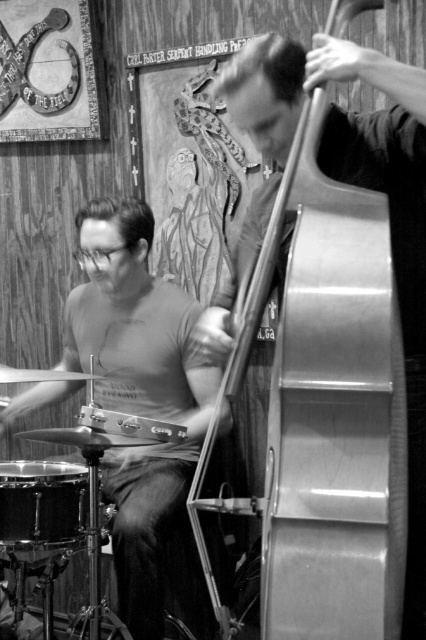
You are a stagehand setting up equipment for a performance. You need to move both the matte black drum set at left and the metallic silver cello at right. Which object requires more space to move around due to its size?

The matte black drum set at left requires more space to move around because it has a larger size compared to the metallic silver cello at right.

You are a stagehand setting up microphones for the drum set and the individual drum. You need to place a microphone stand that is 1.5 meters tall. Which object, the matte black drum set at left or the black drum at lower left, will require the stand to be raised higher to capture the sound properly?

The matte black drum set at left is much taller as black drum at lower left, so the microphone stand needs to be raised higher for the matte black drum set at left to capture the sound properly.

You are standing in the live music venue and want to know which point is closer to you. The points are point (120, 396) and point (213, 326). Which one is closer?

Point (120, 396) is closer to you because it is further to the viewer than point (213, 326).